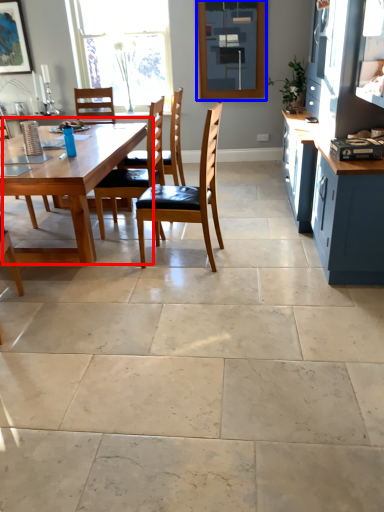
Question: Which of the following is the closest to the observer, kitchen & dining room table (highlighted by a red box) or window screen (highlighted by a blue box)?

Choices:
 (A) kitchen & dining room table
 (B) window screen

Answer: (A)